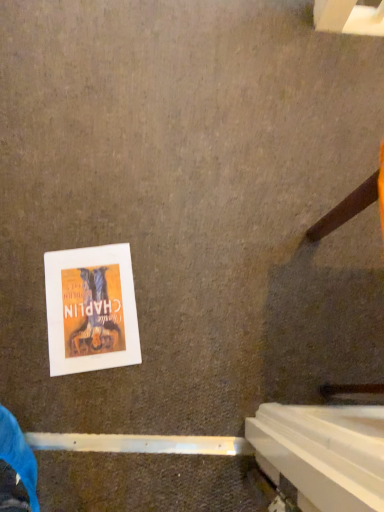
At what (x,y) coordinates should I click in order to perform the action: click on empty space that is ontop of matte paper poster at lower left (from a real-world perspective). Please return your answer as a coordinate pair (x, y). The image size is (384, 512). Looking at the image, I should click on (91, 304).